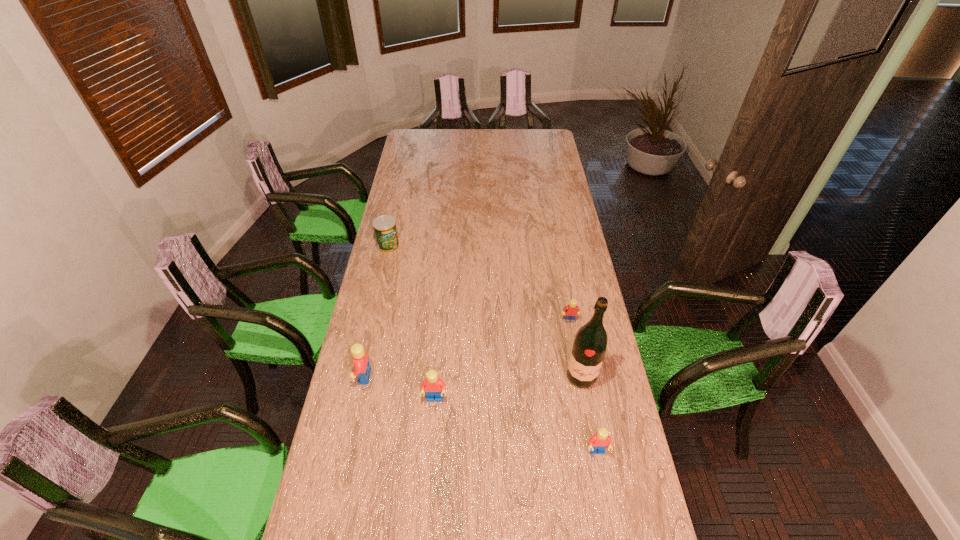
The height and width of the screenshot is (540, 960). Find the location of `the leftmost Lego`. the leftmost Lego is located at coordinates [x=361, y=362].

You are a GUI agent. You are given a task and a screenshot of the screen. Output one action in this format:
    pyautogui.click(x=<x>, y=<y>)
    Task: Click on the second nearest Lego
    The image size is (960, 540).
    Given the screenshot: What is the action you would take?
    pyautogui.click(x=433, y=385)

The image size is (960, 540). In order to click on the fifth farthest object in this screenshot , I will do tap(433, 385).

Locate an element on the screen. the nearest object is located at coordinates (599, 441).

Locate an element on the screen. The image size is (960, 540). the fifth nearest object is located at coordinates (572, 310).

I want to click on the tallest object, so click(590, 343).

You are a GUI agent. You are given a task and a screenshot of the screen. Output one action in this format:
    pyautogui.click(x=<x>, y=<y>)
    Task: Click on the can
    The image size is (960, 540).
    Given the screenshot: What is the action you would take?
    pyautogui.click(x=385, y=230)

I want to click on free location located 0.220m on the face of the second Lego from left to right, so click(x=428, y=474).

What are the coordinates of `blank space located on the front-facing side of the farthest Lego` in the screenshot? It's located at (573, 342).

At what (x,y) coordinates should I click in order to perform the action: click on free space located 0.100m on the front-facing side of the tallest object. Please return your answer as a coordinate pair (x, y). Looking at the image, I should click on (588, 417).